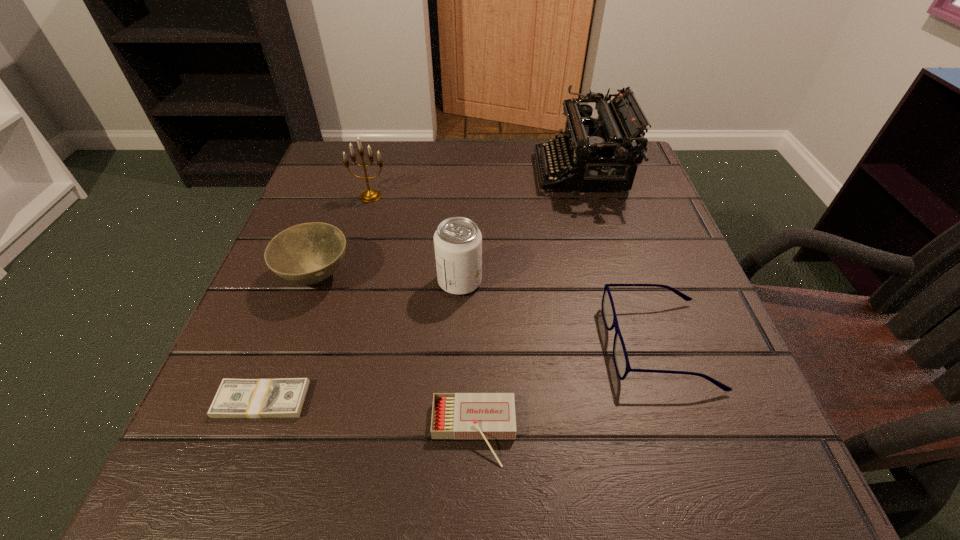
At what (x,y) coordinates should I click in order to perform the action: click on typewriter. Please return your answer as a coordinate pair (x, y). Looking at the image, I should click on (600, 153).

Locate an element on the screen. candelabrum is located at coordinates (370, 195).

Identify the location of the fifth shortest object. (457, 241).

This screenshot has height=540, width=960. I want to click on the fourth tallest object, so click(308, 253).

Locate an element on the screen. The width and height of the screenshot is (960, 540). the third shortest object is located at coordinates (621, 361).

Image resolution: width=960 pixels, height=540 pixels. I want to click on the second shortest object, so click(x=485, y=416).

Find the location of a particular element. The image size is (960, 540). dollar is located at coordinates (236, 398).

At what (x,y) coordinates should I click in order to perform the action: click on blank area located on the keyboard of the typewriter. Please return your answer as a coordinate pair (x, y). The image size is (960, 540). Looking at the image, I should click on (457, 172).

You are a GUI agent. You are given a task and a screenshot of the screen. Output one action in this format:
    pyautogui.click(x=<x>, y=<y>)
    Task: Click on the vacant area situated 0.140m on the keyboard of the typewriter
    The height and width of the screenshot is (540, 960).
    Given the screenshot: What is the action you would take?
    pyautogui.click(x=478, y=172)

You are a GUI agent. You are given a task and a screenshot of the screen. Output one action in this format:
    pyautogui.click(x=<x>, y=<y>)
    Task: Click on the free spot located on the keyboard of the typewriter
    Image resolution: width=960 pixels, height=540 pixels.
    Given the screenshot: What is the action you would take?
    pyautogui.click(x=398, y=172)